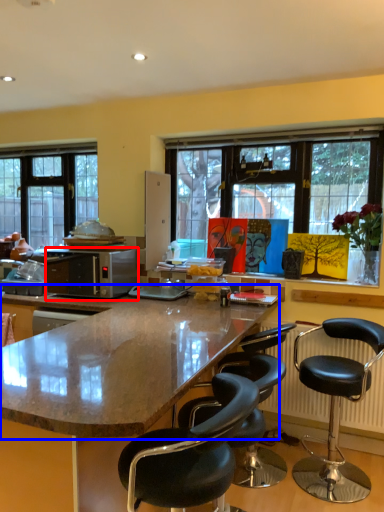
Question: Which point is further to the camera, microwave oven (highlighted by a red box) or countertop (highlighted by a blue box)?

Choices:
 (A) microwave oven
 (B) countertop

Answer: (A)